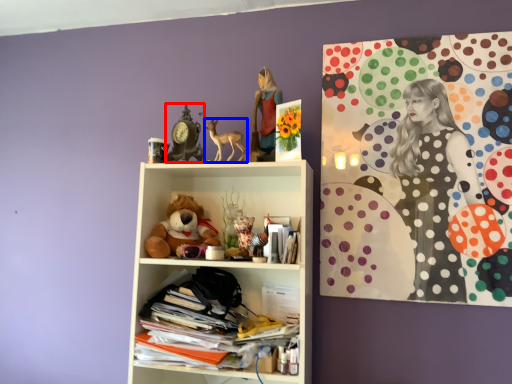
Question: Which of the following is the closest to the observer, art (highlighted by a red box) or toy (highlighted by a blue box)?

Choices:
 (A) art
 (B) toy

Answer: (B)